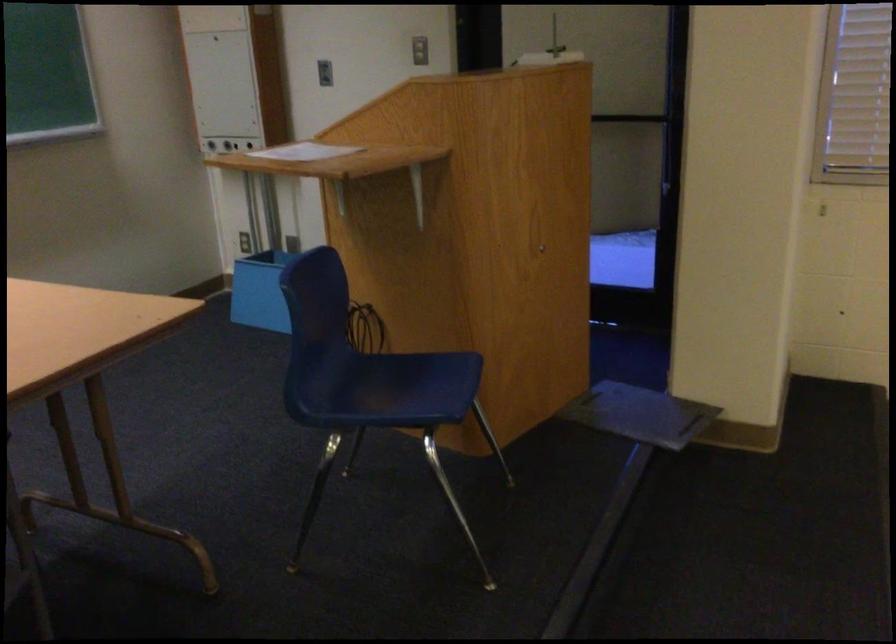
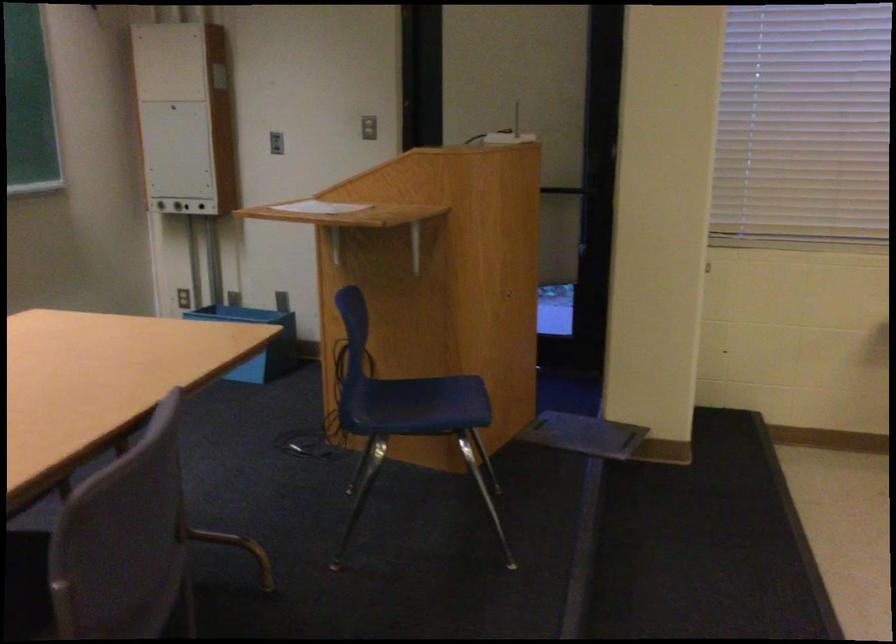
Where in the second image is the point corresponding to [170,319] from the first image?

(256, 341)